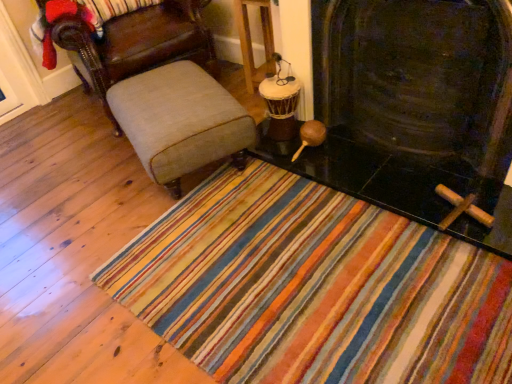
Describe the element at coordinates (413, 109) in the screenshot. I see `black stone fireplace at center` at that location.

This screenshot has width=512, height=384. Identify the location of beige fabric ottoman at center. (180, 121).

You are a GUI agent. You are given a task and a screenshot of the screen. Output one action in this format:
    pyautogui.click(x=<x>, y=<y>)
    Task: Click on the black stone fireplace at center
    
    Given the screenshot: What is the action you would take?
    pyautogui.click(x=413, y=109)

The height and width of the screenshot is (384, 512). In order to click on table lying above the beige fabric ottoman at center (from the image's perspective) in this screenshot , I will do `click(251, 42)`.

Looking at the image, does wooden drum at center seem bigger or smaller compared to beige fabric ottoman at center?

Clearly, wooden drum at center is smaller in size than beige fabric ottoman at center.

Consider the image. Is wooden drum at center with light beige fabric chair at left?

wooden drum at center and light beige fabric chair at left are not in contact.

Would you say wooden drum at center is inside or outside light beige fabric chair at left?

wooden drum at center is spatially situated outside light beige fabric chair at left.

Who is shorter, wooden drum at center or light beige fabric chair at left?

With less height is wooden drum at center.

Locate an element on the screen. table that appears above the black stone fireplace at center (from the image's perspective) is located at coordinates (251, 42).

Can you confirm if wooden drum at center is smaller than black stone fireplace at center?

Indeed, wooden drum at center has a smaller size compared to black stone fireplace at center.

Does wooden drum at center turn towards black stone fireplace at center?

No, wooden drum at center is not facing towards black stone fireplace at center.

Is wooden drum at center wider or thinner than black stone fireplace at center?

Clearly, wooden drum at center has more width compared to black stone fireplace at center.

Between point (220, 144) and point (247, 14), which one is positioned in front?

The point (220, 144) is closer.

Identify the location of table located behind the beige fabric ottoman at center. (251, 42).

Is beige fabric ottoman at center spatially inside wooden drum at center, or outside of it?

beige fabric ottoman at center is spatially situated outside wooden drum at center.

Where is `table on the right of light beige fabric chair at left`? The width and height of the screenshot is (512, 384). table on the right of light beige fabric chair at left is located at coordinates (251, 42).

From the picture: Does light beige fabric chair at left have a smaller size compared to wooden drum at center?

Incorrect, light beige fabric chair at left is not smaller in size than wooden drum at center.

From a real-world perspective, is light beige fabric chair at left positioned above or below wooden drum at center?

From a real-world perspective, light beige fabric chair at left is physically above wooden drum at center.

Would you say light beige fabric chair at left contains wooden drum at center?

No, wooden drum at center is not inside light beige fabric chair at left.

Which of these two, light beige fabric chair at left or black stone fireplace at center, stands shorter?

black stone fireplace at center is shorter.

Which object is thinner, light beige fabric chair at left or black stone fireplace at center?

black stone fireplace at center.

From a real-world perspective, does light beige fabric chair at left stand above black stone fireplace at center?

Actually, light beige fabric chair at left is physically below black stone fireplace at center in the real world.

Does light beige fabric chair at left have a smaller size compared to black stone fireplace at center?

No, light beige fabric chair at left is not smaller than black stone fireplace at center.

In the scene shown: Does light beige fabric chair at left turn towards beige fabric ottoman at center?

Yes, light beige fabric chair at left is aimed at beige fabric ottoman at center.

The width and height of the screenshot is (512, 384). In order to click on chair that is behind the beige fabric ottoman at center in this screenshot , I will do `click(136, 44)`.

Are light beige fabric chair at left and beige fabric ottoman at center making contact?

No.

Where is `furniture lying on the left of wooden drum at center`? furniture lying on the left of wooden drum at center is located at coordinates (180, 121).

The height and width of the screenshot is (384, 512). Find the location of `chair above the wooden drum at center (from a real-world perspective)`. chair above the wooden drum at center (from a real-world perspective) is located at coordinates (136, 44).

From the image, which object appears to be nearer to black stone fireplace at center, light beige fabric chair at left or beige fabric ottoman at center?

beige fabric ottoman at center is closer to black stone fireplace at center.

Considering their positions, is beige fabric ottoman at center positioned closer to light beige fabric chair at left than wooden drum at center?

Among the two, beige fabric ottoman at center is located nearer to light beige fabric chair at left.

From the picture: From the image, which object appears to be farther from light beige fabric chair at left, beige fabric ottoman at center or black stone fireplace at center?

Based on the image, black stone fireplace at center appears to be further to light beige fabric chair at left.

Considering their positions, is black stone fireplace at center positioned closer to wooden drum at center than light beige fabric chair at left?

light beige fabric chair at left lies closer to wooden drum at center than the other object.

Considering their positions, is wooden drum at center positioned further to light beige fabric chair at left than black stone fireplace at center?

black stone fireplace at center.

Estimate the real-world distances between objects in this image. Which object is closer to beige fabric ottoman at center, black stone fireplace at center or light beige fabric chair at left?

light beige fabric chair at left is positioned closer to the anchor beige fabric ottoman at center.

Looking at the image, which one is located further to beige fabric ottoman at center, wooden drum at center or black stone fireplace at center?

Based on the image, wooden drum at center appears to be further to beige fabric ottoman at center.

Looking at the image, which one is located further to wooden drum at center, light beige fabric chair at left or black stone fireplace at center?

Based on the image, black stone fireplace at center appears to be further to wooden drum at center.

Image resolution: width=512 pixels, height=384 pixels. Find the location of `table between light beige fabric chair at left and black stone fireplace at center in the horizontal direction`. table between light beige fabric chair at left and black stone fireplace at center in the horizontal direction is located at coordinates (251, 42).

At what (x,y) coordinates should I click in order to perform the action: click on furniture between light beige fabric chair at left and wooden drum at center from left to right. Please return your answer as a coordinate pair (x, y). Image resolution: width=512 pixels, height=384 pixels. Looking at the image, I should click on (180, 121).

At what (x,y) coordinates should I click in order to perform the action: click on table between beige fabric ottoman at center and black stone fireplace at center. Please return your answer as a coordinate pair (x, y). Looking at the image, I should click on (251, 42).

Find the location of `furniture between light beige fabric chair at left and black stone fireplace at center`. furniture between light beige fabric chair at left and black stone fireplace at center is located at coordinates (180, 121).